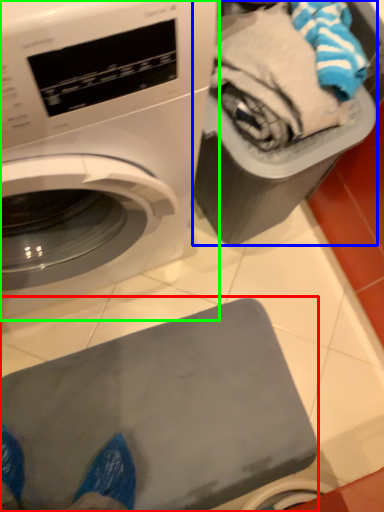
Question: Based on their relative distances, which object is farther from appliance (highlighted by a red box)? Choose from garbage (highlighted by a blue box) and washing machine (highlighted by a green box).

Choices:
 (A) garbage
 (B) washing machine

Answer: (A)